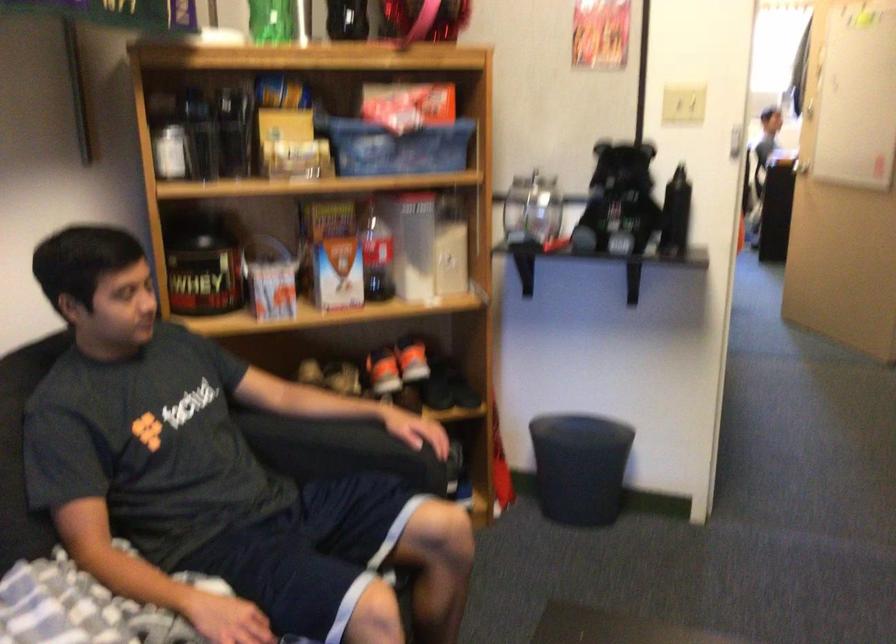
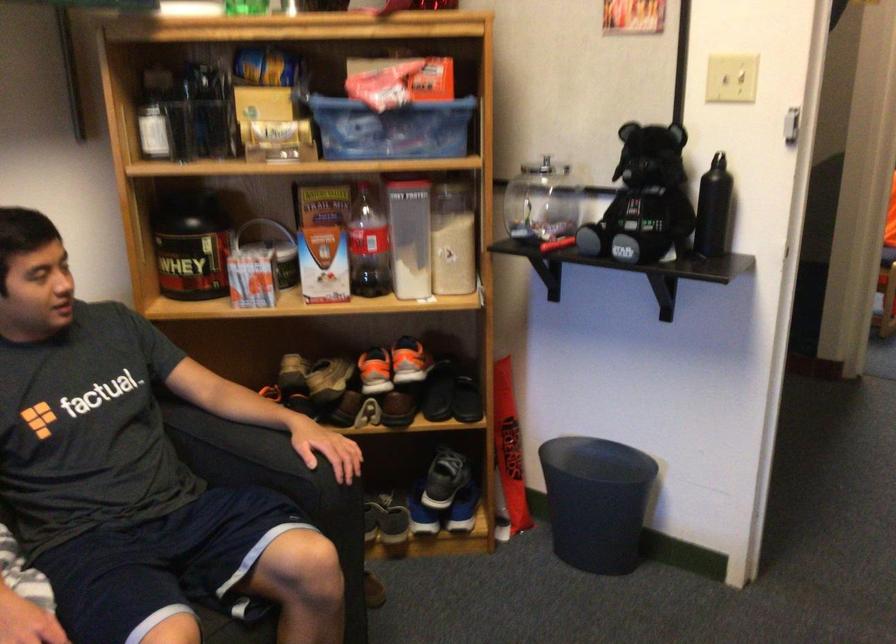
Locate, in the second image, the point that corresponds to point 454,194 in the first image.

(455, 184)